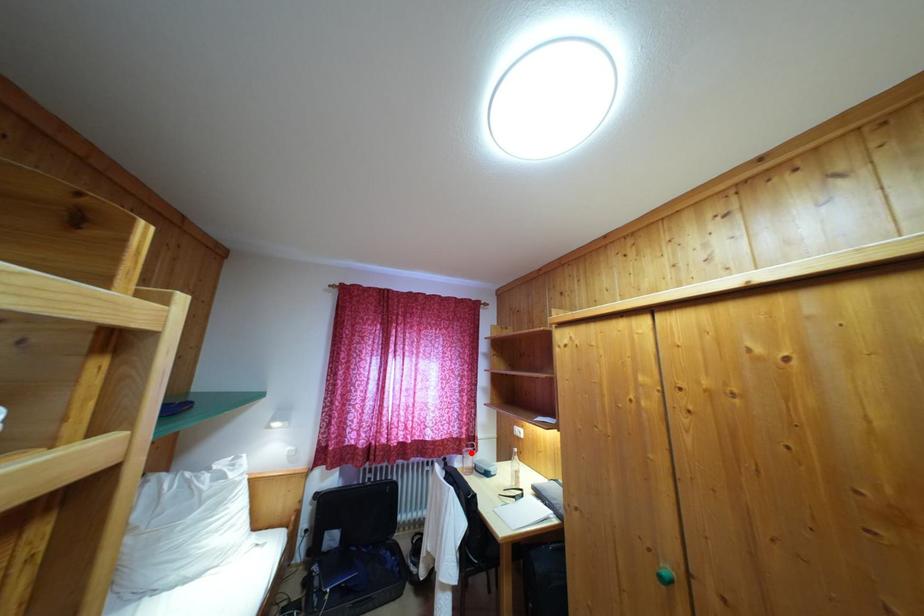
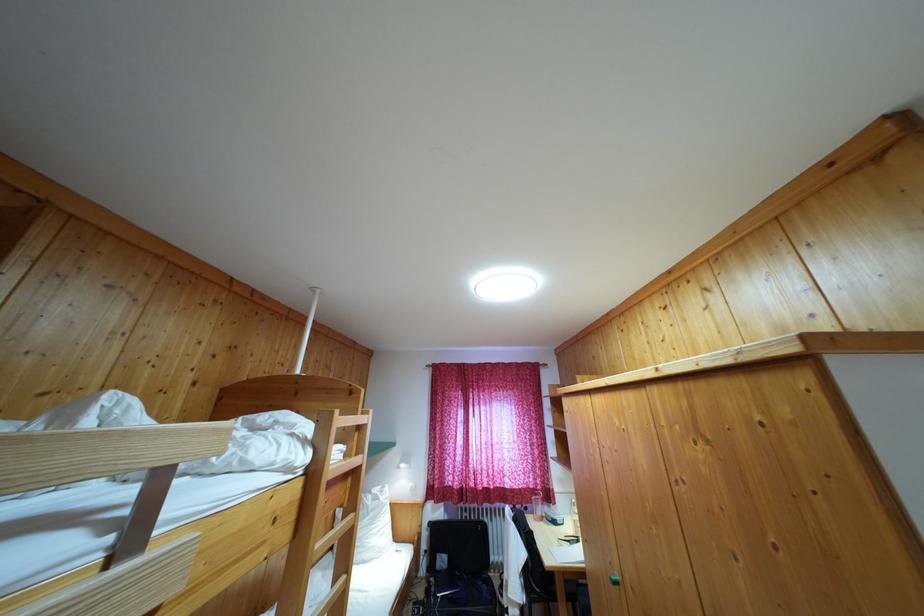
Question: I am providing you with two images of the same scene from different viewpoints. A red point is shown in image1. For the corresponding object point in image2, is it positioned nearer or farther from the camera?

Choices:
 (A) Nearer
 (B) Farther

Answer: (B)